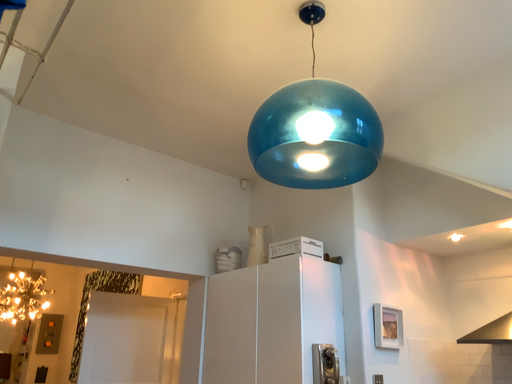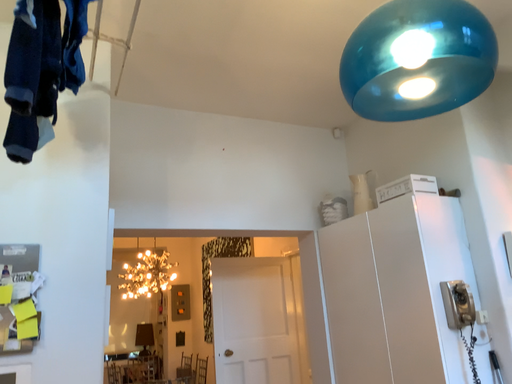
Question: How did the camera likely rotate when shooting the video?

Choices:
 (A) rotated downward
 (B) rotated upward

Answer: (A)